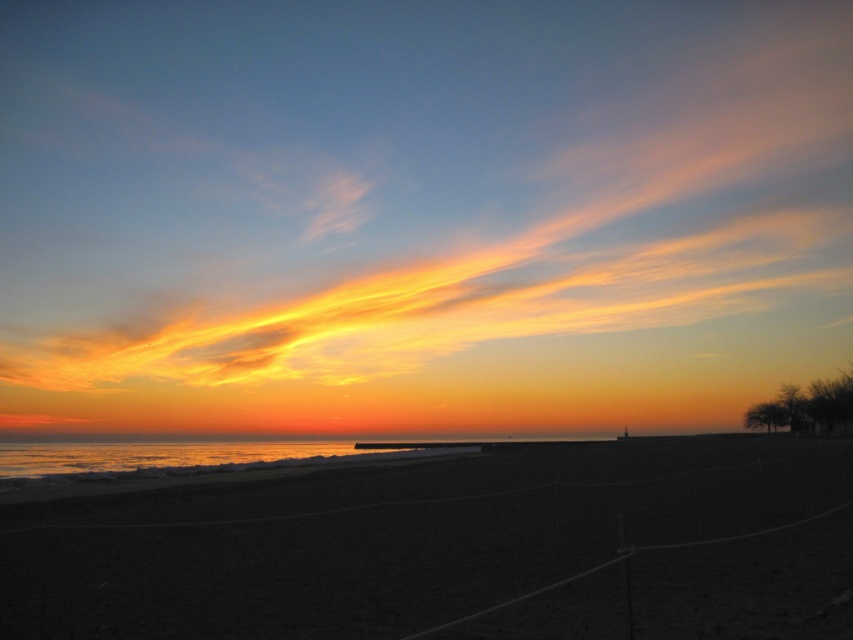
What object is located at the coordinates point [419,214] in the beach scene?

The point [419,214] corresponds to golden translucent clouds at upper center.

You are a photographer trying to capture the golden translucent clouds at upper center and the dark sand at center in a single shot. Which object will appear larger in the photo?

The golden translucent clouds at upper center will appear larger in the photo because they are much taller than the dark sand at center.